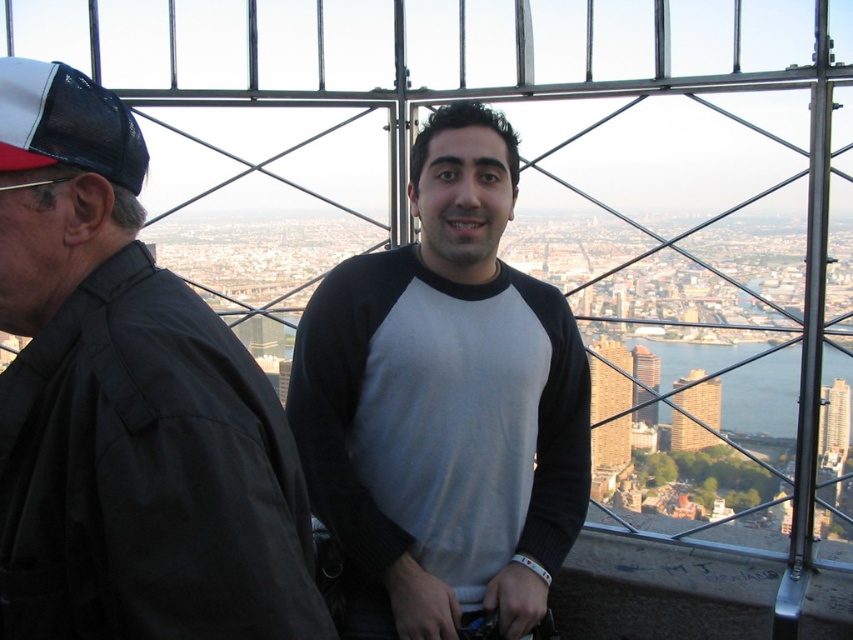
You are a drone operator planning to fly a drone between the brown brick building at center and the glassy reflective skyscraper at center. The drone has a maximum flight distance of 50 meters. Can the drone safely travel between them without exceeding its range?

The distance between the brown brick building at center and the glassy reflective skyscraper at center is 50.45 meters. Since the drone has a maximum flight distance of 50 meters, it cannot safely travel between them without exceeding its range.